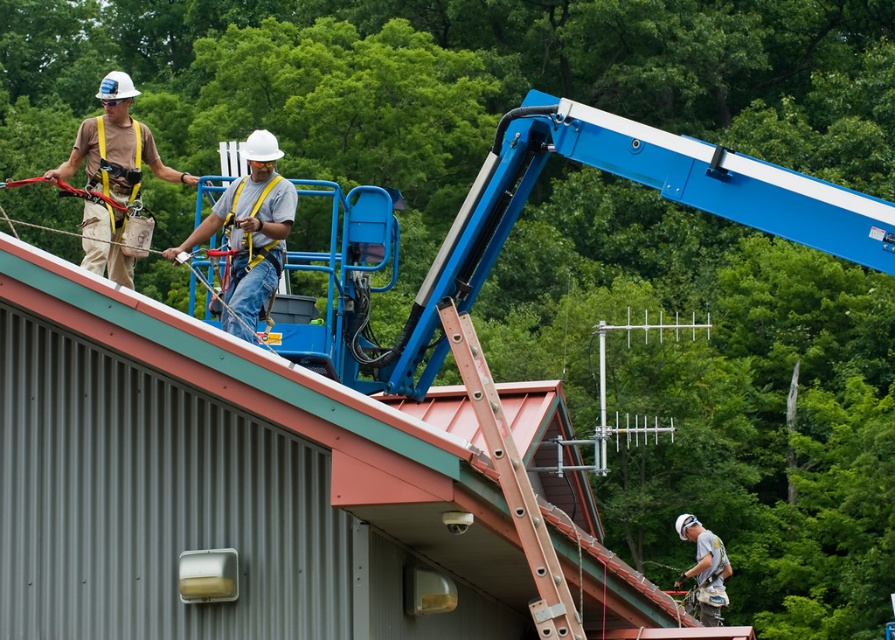
You are a worker on the roof of the building. You need to reach the security camera mounted on the wall near the roofline. There is a metallic orange ladder at center located at point (512, 481). Can you use the metallic orange ladder at center to reach the security camera?

The metallic orange ladder at center is located at point (512, 481). Since the security camera is mounted on the wall near the roofline, the ladder is positioned at the center, which is likely near the roofline where the camera is mounted. Therefore, the worker can use the metallic orange ladder at center to reach the security camera.

Looking at the construction site, where is the white hard hat at center in relation to the matte khaki pants at upper left?

The white hard hat at center is to the right of the matte khaki pants at upper left.